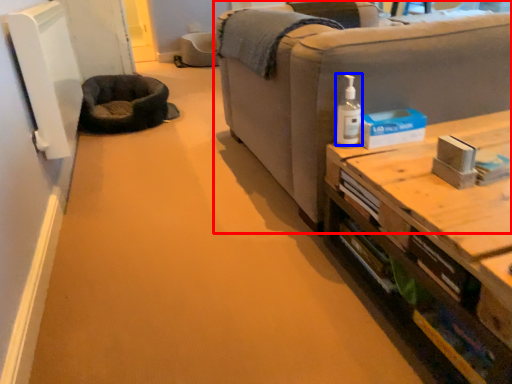
Question: Which object appears farthest to the camera in this image, studio couch (highlighted by a red box) or toiletry (highlighted by a blue box)?

Choices:
 (A) studio couch
 (B) toiletry

Answer: (B)